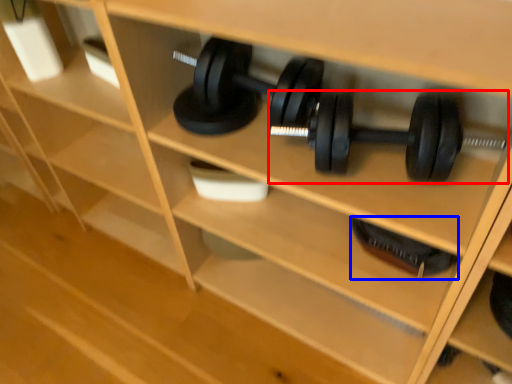
Question: Which of the following is the farthest to the observer, dumbbell (highlighted by a red box) or dumbbell (highlighted by a blue box)?

Choices:
 (A) dumbbell
 (B) dumbbell

Answer: (B)